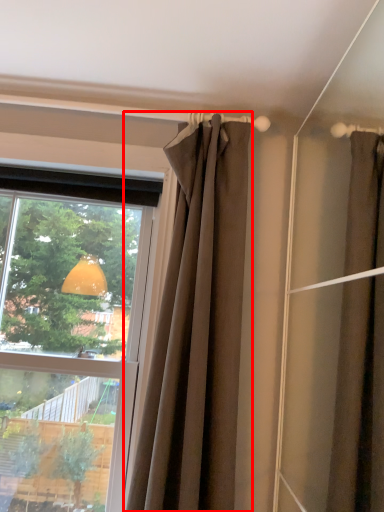
Question: From the image's perspective, where is curtain (annotated by the red box) located relative to window?

Choices:
 (A) below
 (B) above

Answer: (B)